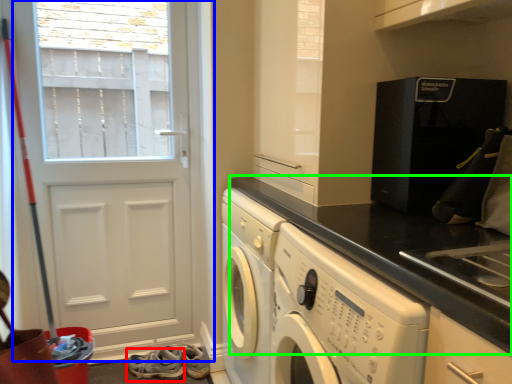
Question: Which object is positioned closest to shoe (highlighted by a red box)? Select from door (highlighted by a blue box) and countertop (highlighted by a green box).

Choices:
 (A) door
 (B) countertop

Answer: (A)